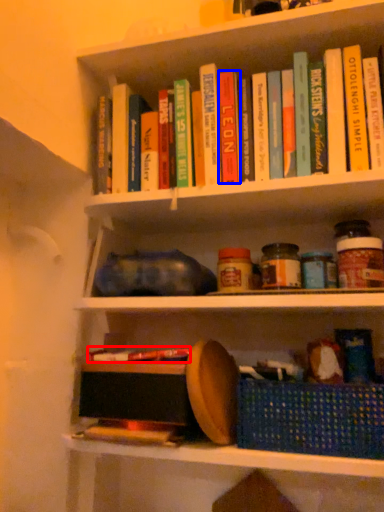
Question: Which point is further to the camera, book (highlighted by a red box) or paperback book (highlighted by a blue box)?

Choices:
 (A) book
 (B) paperback book

Answer: (B)